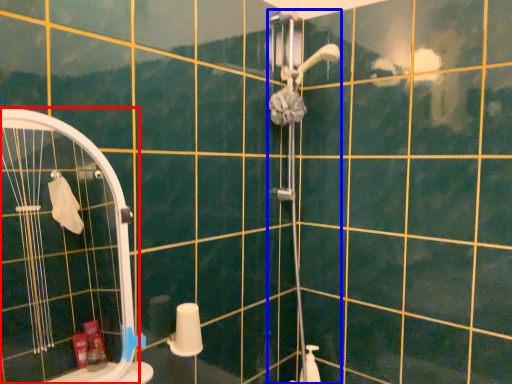
Question: Which point is closer to the camera, screen door (highlighted by a red box) or shower door (highlighted by a blue box)?

Choices:
 (A) screen door
 (B) shower door

Answer: (A)